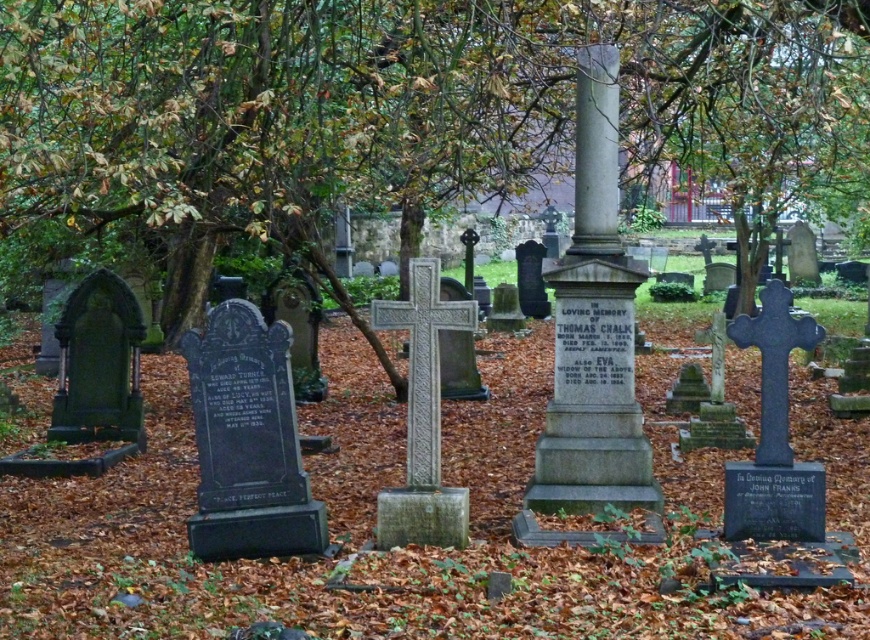
You are standing in a cemetery and want to take a photo of both the green leafy tree at center and the gray stone column at center. Which object will appear larger in the photo?

The green leafy tree at center will appear larger in the photo because it is bigger than the gray stone column at center.

You are standing in the cemetery and want to place a small bouquet between the green leafy tree at center and the gray stone column at center. Based on their widths, which object should you position the bouquet closer to to ensure it fits comfortably?

The green leafy tree at center is wider than the gray stone column at center. Therefore, positioning the bouquet closer to the green leafy tree at center will provide more space for it to fit comfortably.

From the picture: You are standing in the cemetery and want to take a photo of both the green leafy tree at center and the gray stone column at center. Which object should you position to your left side to capture both in the frame?

To capture both the green leafy tree at center and the gray stone column at center in the frame, position the green leafy tree at center to your left side since it is located to the left of the gray stone column at center.